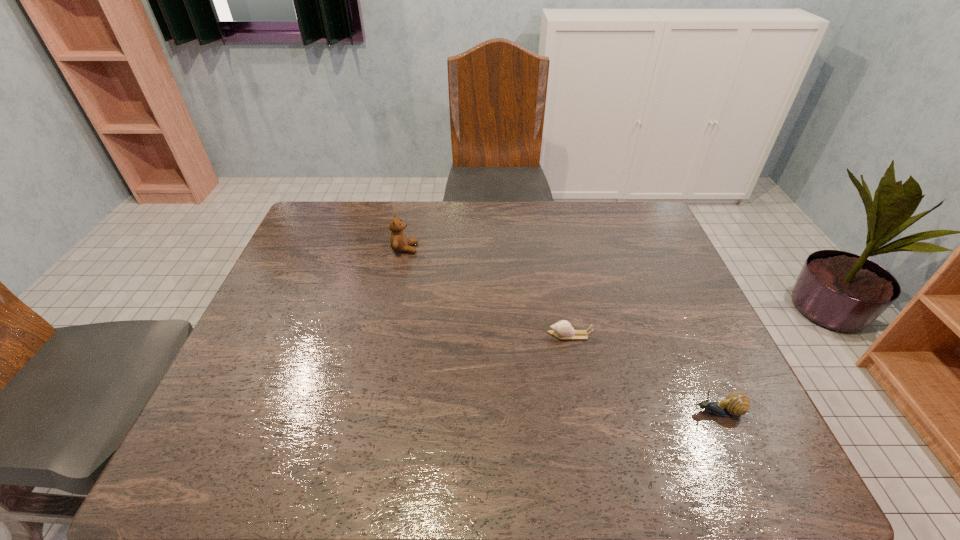
Identify the location of the leftmost object. (398, 240).

At what (x,y) coordinates should I click in order to perform the action: click on teddy bear. Please return your answer as a coordinate pair (x, y). The image size is (960, 540). Looking at the image, I should click on (398, 240).

Where is `the rightmost object`? This screenshot has height=540, width=960. the rightmost object is located at coordinates (736, 404).

Where is `the nearer escargot`? The height and width of the screenshot is (540, 960). the nearer escargot is located at coordinates (736, 404).

Where is `the second object from left to right`? Image resolution: width=960 pixels, height=540 pixels. the second object from left to right is located at coordinates (563, 329).

This screenshot has width=960, height=540. I want to click on the shortest object, so click(x=563, y=329).

Find the location of `vacant area located 0.120m on the front-facing side of the tallest object`. vacant area located 0.120m on the front-facing side of the tallest object is located at coordinates (457, 248).

The width and height of the screenshot is (960, 540). In order to click on vacant area located on the front-facing side of the taller escargot in this screenshot , I will do `click(627, 412)`.

You are a GUI agent. You are given a task and a screenshot of the screen. Output one action in this format:
    pyautogui.click(x=<x>, y=<y>)
    Task: Click on the free region located 0.210m on the front-facing side of the taller escargot
    The image size is (960, 540).
    Given the screenshot: What is the action you would take?
    pyautogui.click(x=593, y=412)

At what (x,y) coordinates should I click in order to perform the action: click on vacant region located on the front-facing side of the taller escargot. Please return your answer as a coordinate pair (x, y). Looking at the image, I should click on (655, 412).